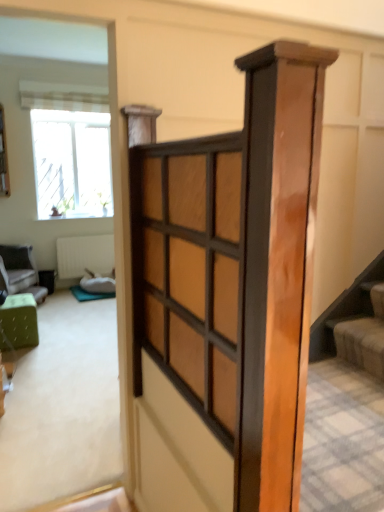
What is the approximate width of soft beige carpet at lower right?

soft beige carpet at lower right is 29.27 centimeters in width.

Measure the distance between green fabric ottoman at left, positioned as the first furniture in left-to-right order, and camera.

green fabric ottoman at left, positioned as the first furniture in left-to-right order, and camera are 4.43 meters apart.

The image size is (384, 512). I want to click on wooden barn door at center, so click(x=235, y=277).

What do you see at coordinates (18, 322) in the screenshot? This screenshot has width=384, height=512. I see `green fabric ottoman at left, which is the first furniture in right-to-left order` at bounding box center [18, 322].

Identify the location of green fabric ottoman at left, which is the first furniture from front to back. The image size is (384, 512). (18, 322).

Where is `soft beige carpet at lower right`? Image resolution: width=384 pixels, height=512 pixels. soft beige carpet at lower right is located at coordinates (363, 335).

Is clear glass window at upper left bigger or smaller than wooden barn door at center?

In the image, clear glass window at upper left appears to be larger than wooden barn door at center.

Based on the photo, how many degrees apart are the facing directions of clear glass window at upper left and wooden barn door at center?

89.4 degrees separate the facing orientations of clear glass window at upper left and wooden barn door at center.

Is clear glass window at upper left directly adjacent to wooden barn door at center?

No, clear glass window at upper left is not beside wooden barn door at center.

Is clear glass window at upper left oriented towards wooden barn door at center?

Yes, clear glass window at upper left is turned towards wooden barn door at center.

Based on the photo, can you tell me how much green fabric ottoman at left, the 1th furniture from the back, and wooden barn door at center differ in facing direction?

34.6 degrees.

From a real-world perspective, between green fabric ottoman at left, the 1th furniture from the back, and wooden barn door at center, who is vertically higher?

In real-world perspective, wooden barn door at center is above.

Looking at the image, does green fabric ottoman at left, positioned as the first furniture in left-to-right order, seem bigger or smaller compared to wooden barn door at center?

Considering their sizes, green fabric ottoman at left, positioned as the first furniture in left-to-right order, takes up more space than wooden barn door at center.

Find the location of a particular element. The image size is (384, 512). radiator above the green fabric ottoman at left, which is the first furniture in right-to-left order (from the image's perspective) is located at coordinates click(x=85, y=255).

Is the depth of white textured radiator at center greater than that of green fabric ottoman at left, which is the first furniture in right-to-left order?

Yes, white textured radiator at center is behind green fabric ottoman at left, which is the first furniture in right-to-left order.

From the image's perspective, which is above, white textured radiator at center or green fabric ottoman at left, which is the first furniture from front to back?

white textured radiator at center is shown above in the image.

Can you confirm if clear glass window at upper left is wider than white textured radiator at center?

Yes, clear glass window at upper left is wider than white textured radiator at center.

Considering the sizes of objects clear glass window at upper left and white textured radiator at center in the image provided, who is shorter, clear glass window at upper left or white textured radiator at center?

white textured radiator at center is shorter.

Is point (58, 198) closer or farther from the camera than point (112, 242)?

Point (58, 198) is positioned farther from the camera compared to point (112, 242).

Is clear glass window at upper left smaller than white textured radiator at center?

Incorrect, clear glass window at upper left is not smaller in size than white textured radiator at center.

Consider the image. From a real-world perspective, is soft beige carpet at lower right positioned under green fabric ottoman at left, which is the first furniture from front to back, based on gravity?

Actually, soft beige carpet at lower right is physically above green fabric ottoman at left, which is the first furniture from front to back, in the real world.

Find the location of a particular element. This screenshot has width=384, height=512. the 1st furniture counting from the left side of the soft beige carpet at lower right is located at coordinates (18, 322).

How different are the orientations of soft beige carpet at lower right and green fabric ottoman at left, which is the second furniture in left-to-right order, in degrees?

The facing directions of soft beige carpet at lower right and green fabric ottoman at left, which is the second furniture in left-to-right order, are 180 degrees apart.

Which point is more distant from viewer, (334, 319) or (22, 297)?

Positioned behind is point (22, 297).

Considering the sizes of objects green fabric ottoman at left, which is the first furniture in right-to-left order, and clear glass window at upper left in the image provided, who is bigger, green fabric ottoman at left, which is the first furniture in right-to-left order, or clear glass window at upper left?

Bigger between the two is clear glass window at upper left.

Which is more to the left, green fabric ottoman at left, which is the first furniture from front to back, or clear glass window at upper left?

green fabric ottoman at left, which is the first furniture from front to back, is more to the left.

Would you consider green fabric ottoman at left, which is the second furniture in left-to-right order, to be distant from clear glass window at upper left?

Yes.

From a real-world perspective, is green fabric ottoman at left, which is the second furniture in left-to-right order, on top of clear glass window at upper left?

Incorrect, from a real-world perspective, green fabric ottoman at left, which is the second furniture in left-to-right order, is lower than clear glass window at upper left.

Based on the photo, choose the correct answer: Is striped fabric curtain at upper left inside soft beige carpet at lower right or outside it?

The correct answer is: outside.

How far apart are striped fabric curtain at upper left and soft beige carpet at lower right?

striped fabric curtain at upper left is 4.31 meters from soft beige carpet at lower right.

Would you say striped fabric curtain at upper left is a long distance from soft beige carpet at lower right?

Absolutely, striped fabric curtain at upper left is distant from soft beige carpet at lower right.

Where is `barn door that is on the right side of clear glass window at upper left`? The height and width of the screenshot is (512, 384). barn door that is on the right side of clear glass window at upper left is located at coordinates (235, 277).

Which furniture is the 2nd one when counting from the left side of the wooden barn door at center? Please provide its 2D coordinates.

[(20, 272)]

From the image, which object appears to be nearer to green fabric ottoman at left, which is the second furniture in front-to-back order, white textured radiator at center or soft beige carpet at lower right?

white textured radiator at center is closer to green fabric ottoman at left, which is the second furniture in front-to-back order.

Considering their positions, is green fabric ottoman at left, which is counted as the second furniture, starting from the back, positioned further to clear glass window at upper left than soft beige carpet at lower right?

soft beige carpet at lower right.

In the scene shown: Considering their positions, is white textured radiator at center positioned closer to wooden barn door at center than soft beige carpet at lower right?

soft beige carpet at lower right.

When comparing their distances from striped fabric curtain at upper left, does clear glass window at upper left or green fabric ottoman at left, which is the first furniture from front to back, seem closer?

clear glass window at upper left is positioned closer to the anchor striped fabric curtain at upper left.

From the image, which object appears to be farther from clear glass window at upper left, white textured radiator at center or green fabric ottoman at left, which is the second furniture in front-to-back order?

Based on the image, green fabric ottoman at left, which is the second furniture in front-to-back order, appears to be further to clear glass window at upper left.

Based on the photo, based on their spatial positions, is green fabric ottoman at left, placed as the second furniture when sorted from right to left, or white textured radiator at center further from soft beige carpet at lower right?

white textured radiator at center is further to soft beige carpet at lower right.

Considering their positions, is green fabric ottoman at left, which is the second furniture in left-to-right order, positioned further to white textured radiator at center than soft beige carpet at lower right?

soft beige carpet at lower right.

When comparing their distances from wooden barn door at center, does clear glass window at upper left or green fabric ottoman at left, positioned as the first furniture in left-to-right order, seem closer?

Among the two, green fabric ottoman at left, positioned as the first furniture in left-to-right order, is located nearer to wooden barn door at center.

At what (x,y) coordinates should I click in order to perform the action: click on furniture between striped fabric curtain at upper left and green fabric ottoman at left, which is counted as the second furniture, starting from the back, in the vertical direction. Please return your answer as a coordinate pair (x, y). Looking at the image, I should click on (20, 272).

In order to click on radiator between clear glass window at upper left and green fabric ottoman at left, which is the second furniture in left-to-right order, in the up-down direction in this screenshot , I will do `click(85, 255)`.

Locate an element on the screen. The height and width of the screenshot is (512, 384). window between wooden barn door at center and white textured radiator at center from front to back is located at coordinates (70, 148).

Image resolution: width=384 pixels, height=512 pixels. Find the location of `furniture between wooden barn door at center and green fabric ottoman at left, placed as the second furniture when sorted from right to left, from front to back`. furniture between wooden barn door at center and green fabric ottoman at left, placed as the second furniture when sorted from right to left, from front to back is located at coordinates (18, 322).